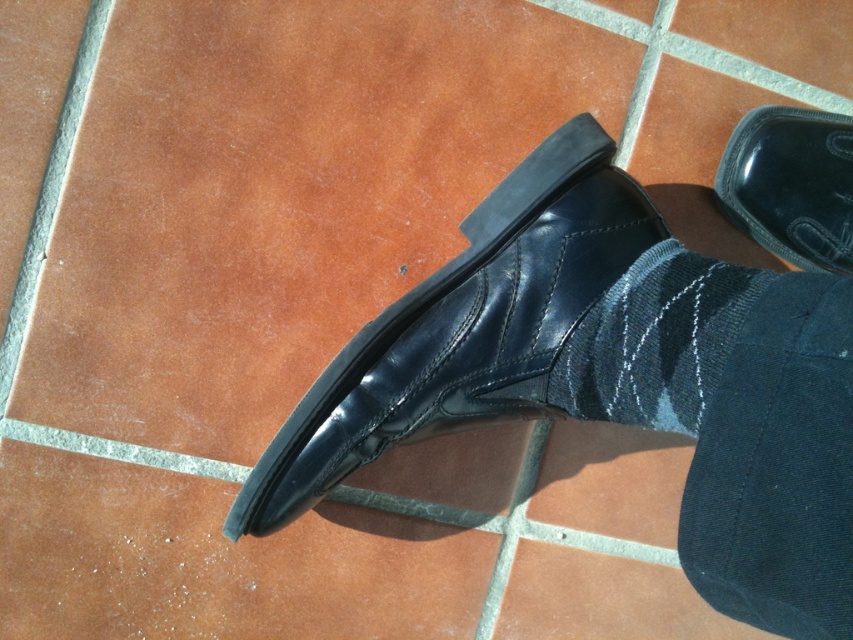
You are a photographer setting up a shoot and need to ensure the two shiny black shoes are exactly 12 inches apart for proper framing. Based on the scene described, are the shiny black shoe at center and the shiny black shoe at upper right positioned correctly for your shoot?

The shiny black shoe at center and shiny black shoe at upper right are 13.69 inches apart, which is more than the required 12 inches. Therefore, they are not positioned correctly for the shoot.

You are an interior designer planning to place a decorative item on the floor. You have a brown leather tile at center and a shiny black shoe at upper right in the scene. Which object has a greater width?

The brown leather tile at center might be wider than shiny black shoe at upper right.

You are designing a floor pattern using the brown matte tile at center and the brown tile at upper right. Since you want to create a balanced design, which tile should you place in areas where a wider tile is needed?

The brown matte tile at center should be placed in areas where a wider tile is needed because its width surpasses that of the brown tile at upper right.